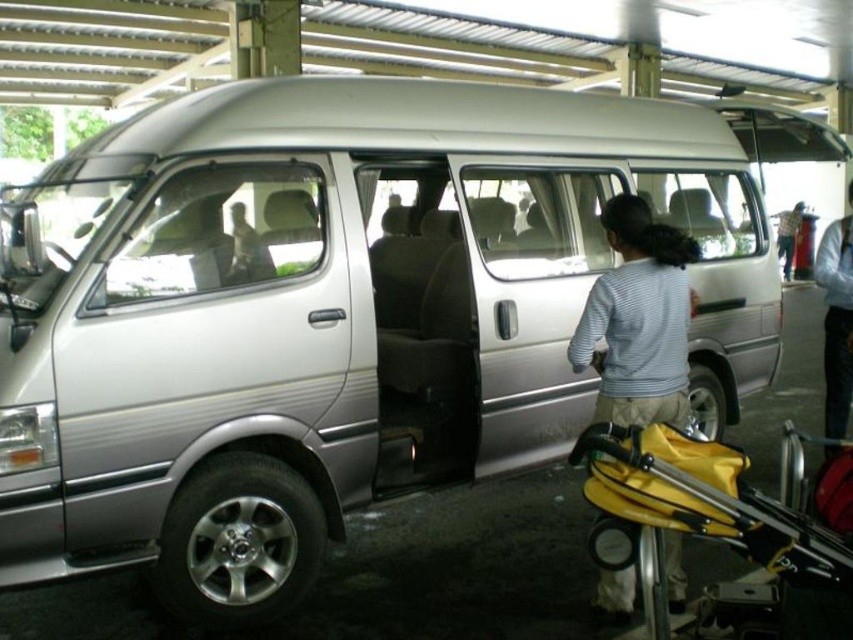
Who is positioned more to the left, yellow plastic baby carriage at lower right or striped fabric shirt at center?

From the viewer's perspective, yellow plastic baby carriage at lower right appears more on the left side.

What do you see at coordinates (692, 509) in the screenshot? This screenshot has height=640, width=853. I see `yellow plastic baby carriage at lower right` at bounding box center [692, 509].

You are a GUI agent. You are given a task and a screenshot of the screen. Output one action in this format:
    pyautogui.click(x=<x>, y=<y>)
    Task: Click on the yellow plastic baby carriage at lower right
    Image resolution: width=853 pixels, height=640 pixels.
    Given the screenshot: What is the action you would take?
    pyautogui.click(x=692, y=509)

Which is more to the left, striped fabric shirt at center or light blue sweater at center?

striped fabric shirt at center is more to the left.

Which is below, striped fabric shirt at center or light blue sweater at center?

striped fabric shirt at center

Is point (674, 260) in front of point (840, 305)?

Yes, it is.

Locate an element on the screen. The width and height of the screenshot is (853, 640). striped fabric shirt at center is located at coordinates (637, 320).

Find the location of a particular element. This screenshot has width=853, height=640. light blue sweater at center is located at coordinates (836, 320).

Does light blue sweater at center have a greater width compared to dark blue jeans at right?

Yes.

Who is more forward, (850,316) or (791,214)?

Point (850,316) is in front.

The image size is (853, 640). Find the location of `light blue sweater at center`. light blue sweater at center is located at coordinates (836, 320).